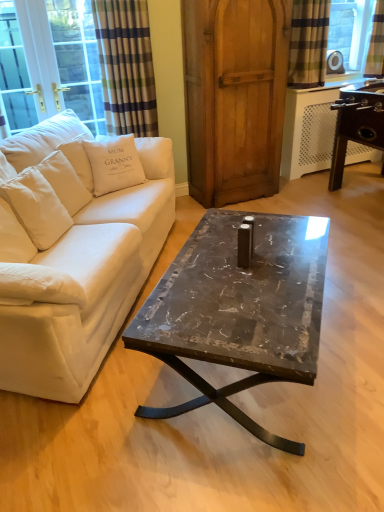
Question: Considering their positions, is white cotton pillow at upper left located in front of or behind plaid fabric curtain at upper right, which is the 2th curtain in left-to-right order?

Choices:
 (A) behind
 (B) front

Answer: (B)

Question: Is white cotton pillow at upper left inside or outside of plaid fabric curtain at upper right, marked as the 2th curtain in a right-to-left arrangement?

Choices:
 (A) inside
 (B) outside

Answer: (B)

Question: Considering the real-world distances, which object is closest to the white fabric couch at left?

Choices:
 (A) plaid fabric curtain at upper right, marked as the 2th curtain in a right-to-left arrangement
 (B) white fabric cushion at left
 (C) marble-coated coffee table at center
 (D) wooden armoire at center
 (E) plaid fabric curtain at upper right, which is the 3th curtain in left-to-right order

Answer: (C)

Question: Which object is positioned farthest from the white fabric cushion at left?

Choices:
 (A) white fabric couch at left
 (B) marble-coated coffee table at center
 (C) plaid fabric curtain at upper right, which is the 2th curtain in left-to-right order
 (D) plaid fabric curtain at upper left, the third curtain positioned from the right
 (E) wooden armoire at center

Answer: (B)